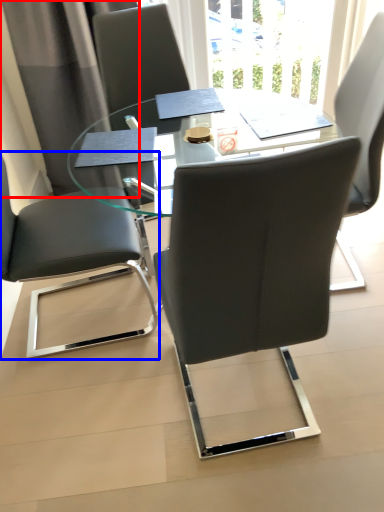
Question: Which object is further to the camera taking this photo, curtain (highlighted by a red box) or chair (highlighted by a blue box)?

Choices:
 (A) curtain
 (B) chair

Answer: (A)